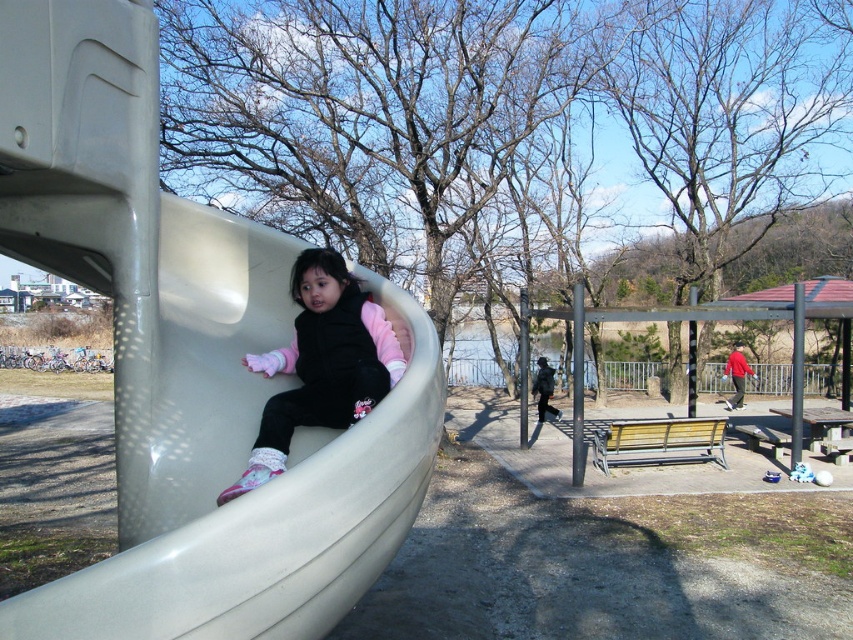
Can you confirm if smooth plastic slide at left is wider than matte pink sweater at center?

In fact, smooth plastic slide at left might be narrower than matte pink sweater at center.

In the scene shown: Who is positioned more to the left, smooth plastic slide at left or matte pink sweater at center?

smooth plastic slide at left is more to the left.

Is point (91, 269) positioned in front of point (381, 385)?

No, (91, 269) is behind (381, 385).

This screenshot has height=640, width=853. Identify the location of smooth plastic slide at left. (245, 460).